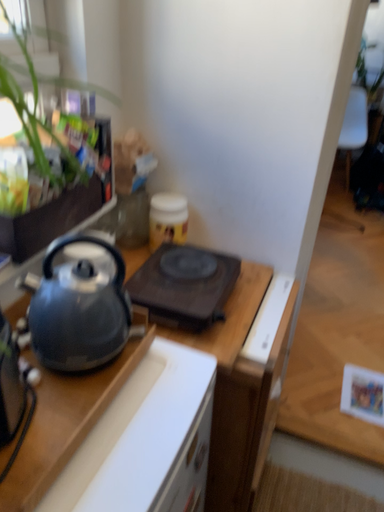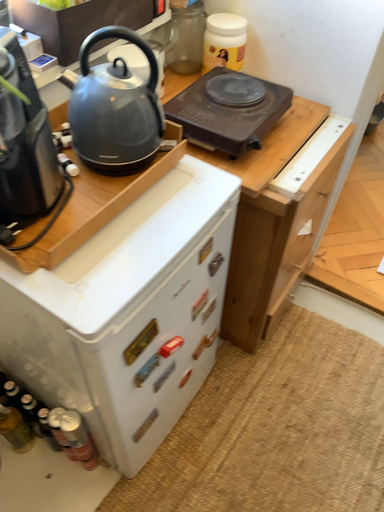
Question: Which way did the camera rotate in the video?

Choices:
 (A) rotated right
 (B) rotated left

Answer: (B)